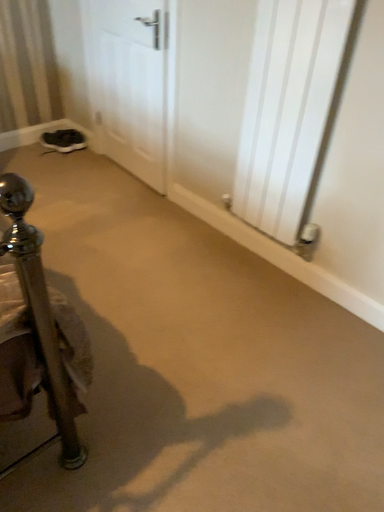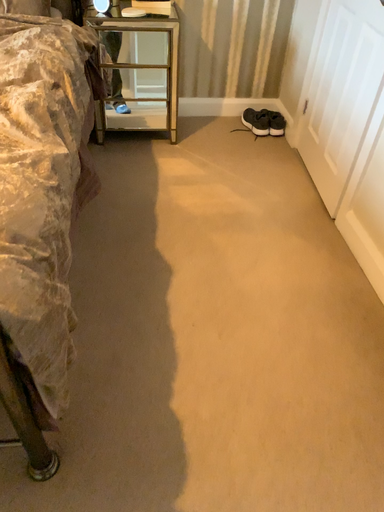
Question: Which way did the camera rotate in the video?

Choices:
 (A) rotated left
 (B) rotated right

Answer: (A)